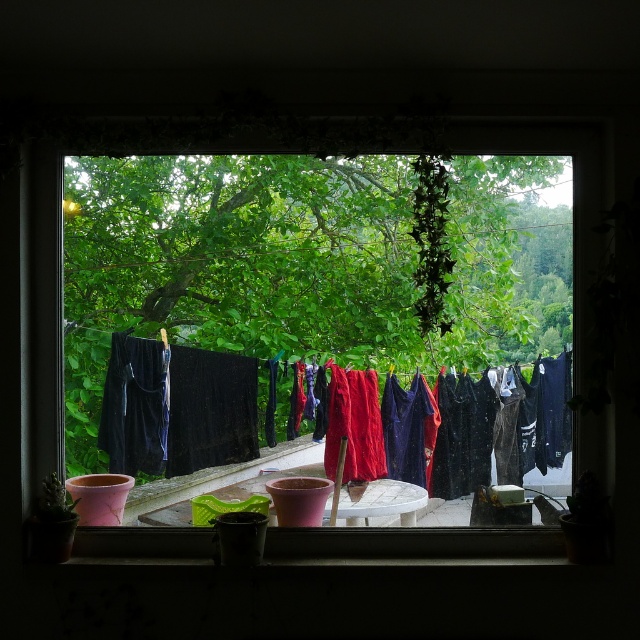
You are a bird flying outside and want to land on the windowsill to rest. You notice the wooden stick near the center and the pink pot on the left. Which object is closer to the point where you are currently hovering at coordinates point [298,275]?

The transparent glass window at center is located at point [298,275]. Since the wooden stick leans against the wall near the center and the pink pot is on the left side, the wooden stick is closer to the point [298,275] than the pink pot on the left.

You are trying to hang a new red towel on the clothesline outside. You see the transparent glass window at center and the red fabric laundry at center. Which object is closer to you, the observer?

The transparent glass window at center is closer to you because it is in front of the red fabric laundry at center.